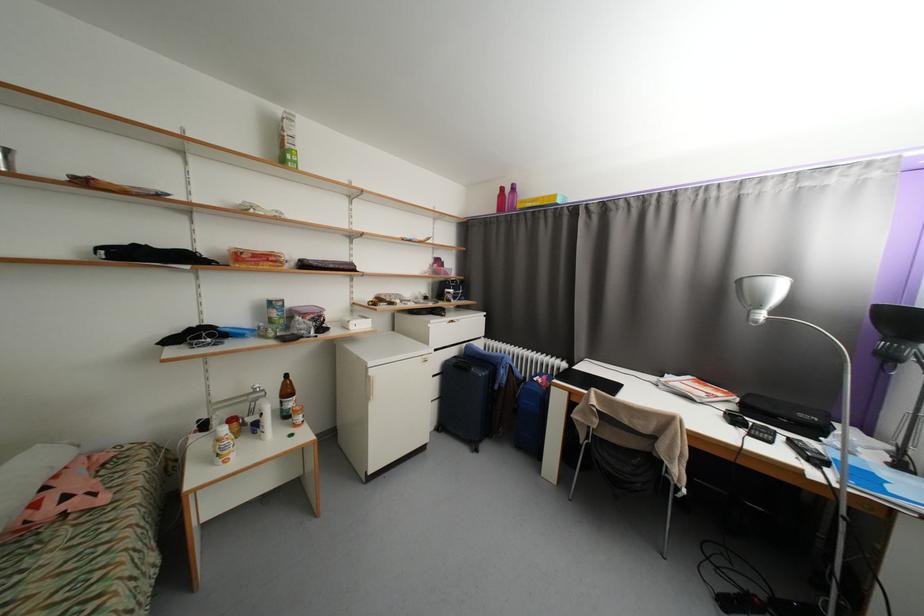
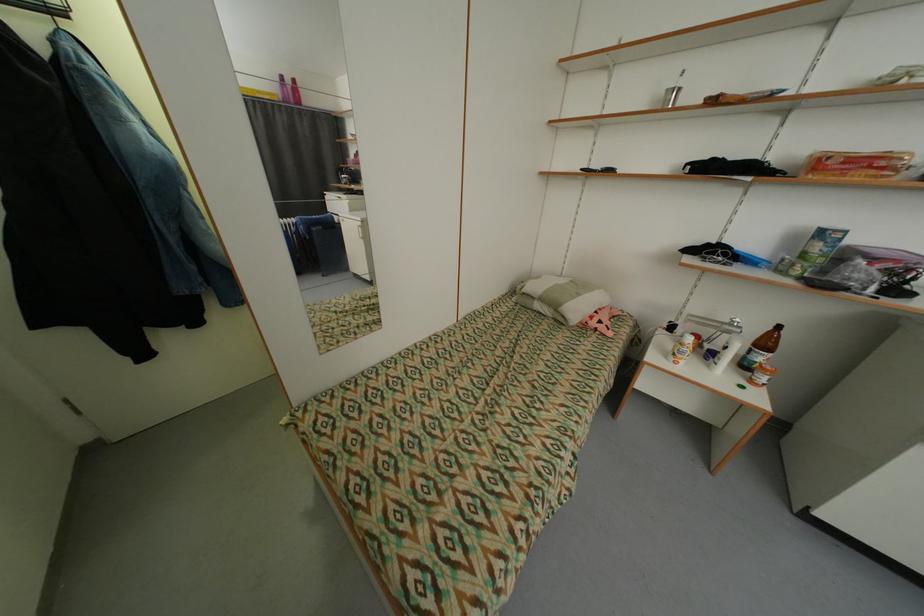
Based on the continuous images, in which direction is the camera rotating?

The rotation direction of the camera is left-down.